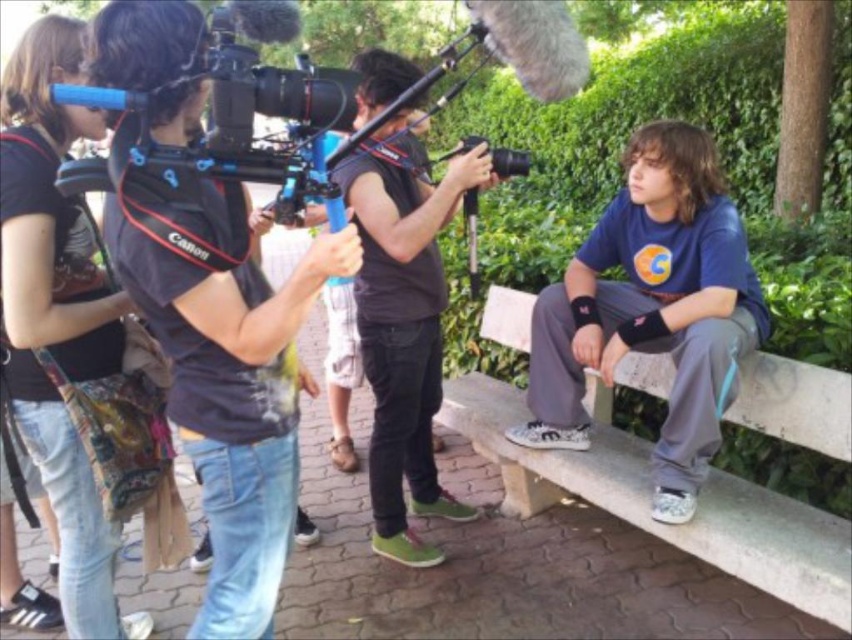
You are an actor waiting for your cue in this outdoor film set. You notice a blue cotton shirt at right and a dark brown leather jacket at center. Which piece of clothing is closer to you?

The blue cotton shirt at right is closer to you because the dark brown leather jacket at center is behind it.

You are an assistant who needs to locate the black fabric camera at center in the image. According to the coordinates provided, where exactly is it positioned?

The black fabric camera at center is positioned at coordinates point (229, 385).

You are an actor waiting for your cue in the park scene. You notice the black fabric camera at center and the blue cotton shirt at right. Which object is closer to the ground?

The black fabric camera at center is positioned under the blue cotton shirt at right, meaning it is closer to the ground than the shirt.